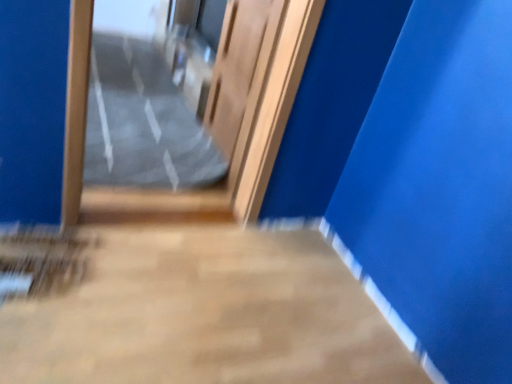
What do you see at coordinates (209, 125) in the screenshot?
I see `wooden door at center` at bounding box center [209, 125].

Find the location of a particular element. This screenshot has height=384, width=512. smooth concrete floor at center is located at coordinates (191, 310).

Is there a large distance between wooden door at center and wooden door at center?

Actually, wooden door at center and wooden door at center are a little close together.

Is wooden door at center to the right of wooden door at center from the viewer's perspective?

No, wooden door at center is not to the right of wooden door at center.

Could wooden door at center be considered to be inside wooden door at center?

No.

Which object is thinner, wooden door at center or smooth concrete floor at center?

wooden door at center.

From a real-world perspective, is wooden door at center positioned under smooth concrete floor at center based on gravity?

No.

Is wooden door at center turned away from smooth concrete floor at center?

wooden door at center does not have its back to smooth concrete floor at center.

Where is `concrete in front of the clear plastic bag at center`? concrete in front of the clear plastic bag at center is located at coordinates (191, 310).

Between smooth concrete floor at center and clear plastic bag at center, which one appears on the left side from the viewer's perspective?

clear plastic bag at center.

From the image's perspective, is smooth concrete floor at center on clear plastic bag at center?

No.

From their relative heights in the image, would you say clear plastic bag at center is taller or shorter than wooden door at center?

Considering their sizes, clear plastic bag at center has less height than wooden door at center.

Who is smaller, clear plastic bag at center or wooden door at center?

Smaller between the two is wooden door at center.

From the picture: Visually, is clear plastic bag at center positioned to the left or to the right of wooden door at center?

From the image, it's evident that clear plastic bag at center is to the left of wooden door at center.

From the picture: Can you see clear plastic bag at center touching wooden door at center?

No, clear plastic bag at center is not with wooden door at center.

Can you tell me how much wooden door at center and smooth concrete floor at center differ in facing direction?

180 degrees.

Does point (258, 80) lie behind point (317, 314)?

Yes, it is.

Is wooden door at center oriented away from smooth concrete floor at center?

That's not correct — wooden door at center is not looking away from smooth concrete floor at center.

What are the coordinates of `path lying on the left of wooden door at center` in the screenshot? It's located at (143, 122).

Considering the sizes of objects clear plastic bag at center and wooden door at center in the image provided, who is wider, clear plastic bag at center or wooden door at center?

clear plastic bag at center.

Considering the positions of objects clear plastic bag at center and wooden door at center in the image provided, who is in front, clear plastic bag at center or wooden door at center?

wooden door at center is closer to the camera.

How many degrees apart are the facing directions of clear plastic bag at center and wooden door at center?

The angle between the facing direction of clear plastic bag at center and the facing direction of wooden door at center is 91.4 degrees.

Is wooden door at center inside or outside of clear plastic bag at center?

wooden door at center is located beyond the bounds of clear plastic bag at center.

From the image's perspective, between wooden door at center and clear plastic bag at center, who is located below?

wooden door at center is shown below in the image.

Does wooden door at center have a greater width compared to clear plastic bag at center?

In fact, wooden door at center might be narrower than clear plastic bag at center.

From a real-world perspective, is wooden door at center on clear plastic bag at center?

Yes, from a real-world perspective, wooden door at center is on top of clear plastic bag at center.

You are a GUI agent. You are given a task and a screenshot of the screen. Output one action in this format:
    pyautogui.click(x=<x>, y=<y>)
    Task: Click on the elevator door above the wooden door at center (from the image's perspective)
    The height and width of the screenshot is (384, 512).
    Given the screenshot: What is the action you would take?
    pyautogui.click(x=241, y=70)

Image resolution: width=512 pixels, height=384 pixels. In order to click on concrete below the wooden door at center (from a real-world perspective) in this screenshot , I will do `click(191, 310)`.

From the image, which object appears to be nearer to wooden door at center, clear plastic bag at center or wooden door at center?

The object closer to wooden door at center is wooden door at center.

Based on their spatial positions, is smooth concrete floor at center or clear plastic bag at center further from wooden door at center?

smooth concrete floor at center.

When comparing their distances from clear plastic bag at center, does wooden door at center or smooth concrete floor at center seem closer?

Based on the image, wooden door at center appears to be nearer to clear plastic bag at center.

Based on their spatial positions, is clear plastic bag at center or wooden door at center closer to smooth concrete floor at center?

wooden door at center is positioned closer to the anchor smooth concrete floor at center.

Based on their spatial positions, is wooden door at center or smooth concrete floor at center closer to wooden door at center?

Among the two, wooden door at center is located nearer to wooden door at center.

Looking at the image, which one is located further to clear plastic bag at center, wooden door at center or wooden door at center?

wooden door at center lies further to clear plastic bag at center than the other object.

Considering their positions, is wooden door at center positioned further to clear plastic bag at center than wooden door at center?

Among the two, wooden door at center is located further to clear plastic bag at center.

Consider the image. When comparing their distances from wooden door at center, does wooden door at center or smooth concrete floor at center seem further?

smooth concrete floor at center.

Image resolution: width=512 pixels, height=384 pixels. In order to click on elevator door that lies between clear plastic bag at center and smooth concrete floor at center from top to bottom in this screenshot , I will do `click(241, 70)`.

At what (x,y) coordinates should I click in order to perform the action: click on door that lies between wooden door at center and smooth concrete floor at center from top to bottom. Please return your answer as a coordinate pair (x, y). This screenshot has height=384, width=512. Looking at the image, I should click on (209, 125).

Image resolution: width=512 pixels, height=384 pixels. I want to click on door between clear plastic bag at center and wooden door at center from left to right, so pyautogui.click(x=209, y=125).

Locate an element on the screen. The width and height of the screenshot is (512, 384). door between clear plastic bag at center and smooth concrete floor at center in the vertical direction is located at coordinates (209, 125).